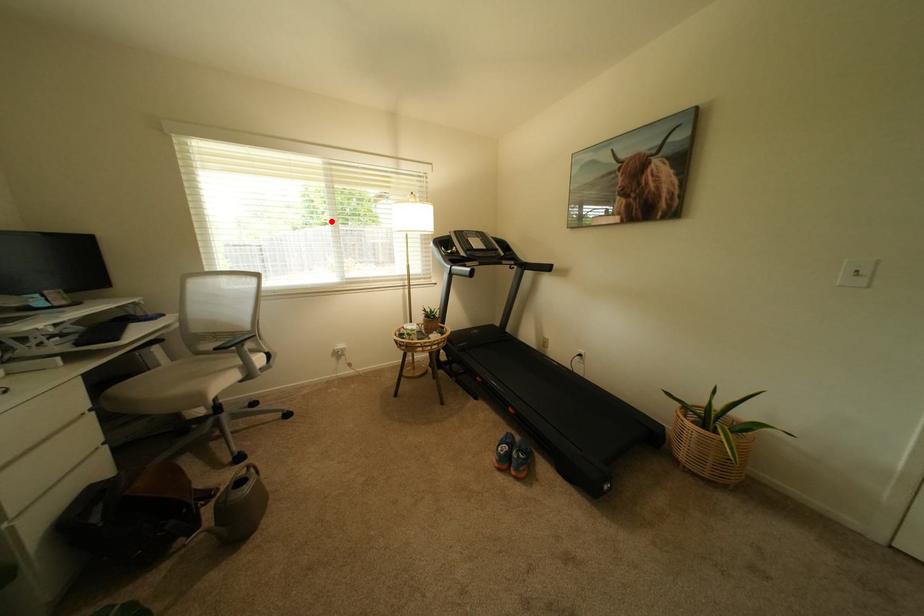
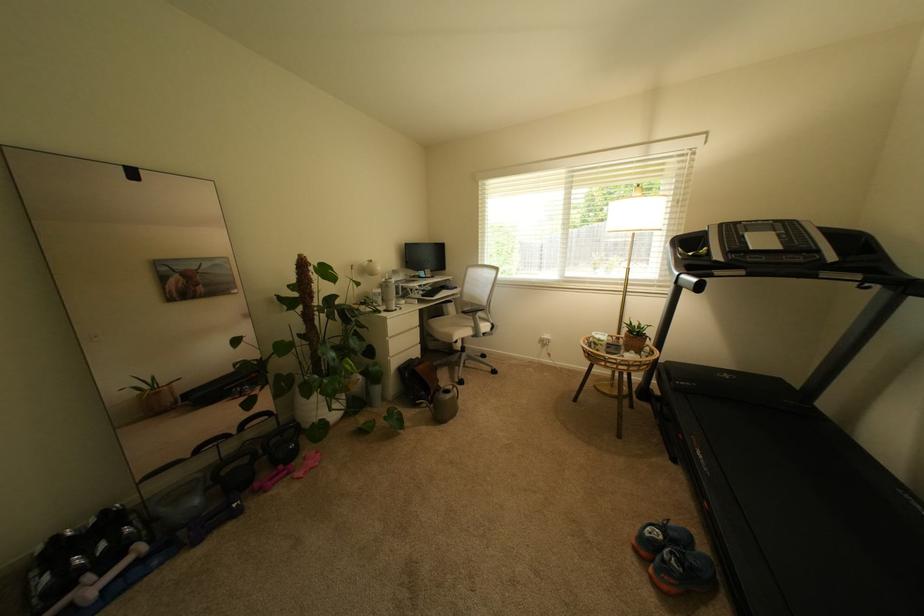
Question: I am providing you with two images of the same scene from different viewpoints. A red point is marked on the first image. Is the red point's position out of view in image 2?

Choices:
 (A) Yes
 (B) No

Answer: (B)